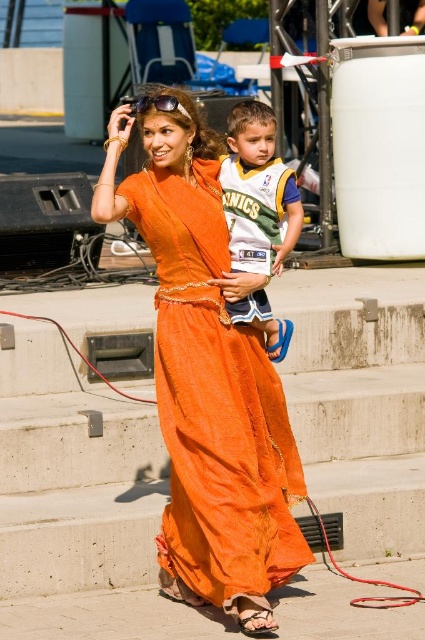
You are standing at a point in the scene and want to know how far you are from the point labeled as point (197, 284). Can you determine the distance?

The distance between you and point (197, 284) is 10.41 meters.

Looking at this image, you are a photographer at the event and want to capture a photo where both the orange silk dress at center and the white jersey at center are visible. Based on their positions, which one should you focus on first to ensure both are in frame?

The orange silk dress at center is below the white jersey at center, so you should focus on the white jersey at center first to ensure both are in frame.

You are a photographer at the event and want to ensure both the orange silk dress at center and the white jersey at center are clearly visible in your photo. Given their sizes, which one should you focus on to capture more detail without cropping?

The white jersey at center occupies more space than the orange silk dress at center, so focusing on the white jersey at center would allow you to capture more detail without cropping.